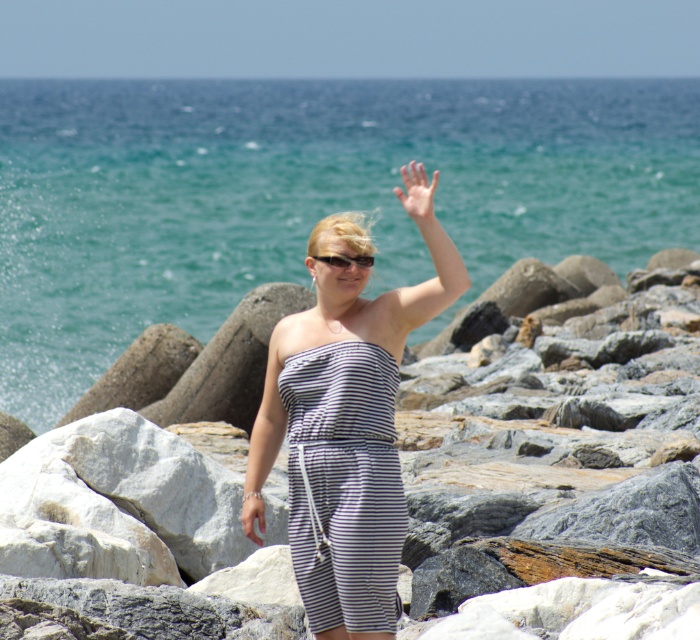
Question: Considering the real-world distances, which object is farthest from the smooth skin hand at center?

Choices:
 (A) gray rock at center
 (B) purple striped dress at center

Answer: (A)

Question: Which is farther from the black plastic sunglasses at center?

Choices:
 (A) smooth skin hand at center
 (B) gray rock at center

Answer: (B)

Question: Can you confirm if smooth skin hand at upper center is positioned to the right of white striped fabric at center?

Choices:
 (A) no
 (B) yes

Answer: (B)

Question: Does blue water at upper center lie in front of purple striped dress at center?

Choices:
 (A) no
 (B) yes

Answer: (A)

Question: Can you confirm if smooth skin hand at upper center is thinner than smooth skin hand at center?

Choices:
 (A) yes
 (B) no

Answer: (B)

Question: Which point is closer to the camera taking this photo?

Choices:
 (A) (351, 259)
 (B) (265, 440)

Answer: (A)